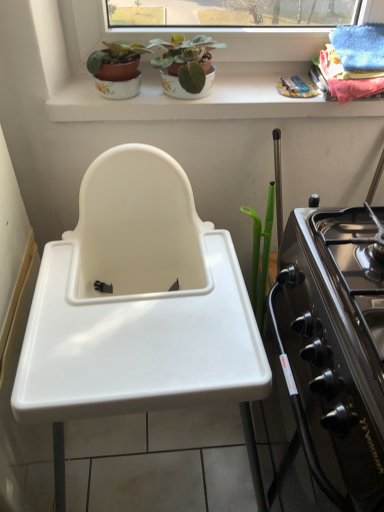
Locate an element on the screen. The width and height of the screenshot is (384, 512). black glossy oven at right is located at coordinates (335, 348).

What do you see at coordinates (203, 99) in the screenshot?
I see `white ceramic window sill at upper center` at bounding box center [203, 99].

The width and height of the screenshot is (384, 512). Describe the element at coordinates (186, 59) in the screenshot. I see `matte ceramic pot at upper center, the 2th houseplant viewed from the left` at that location.

Identify the location of matte ceramic pot at upper center, acting as the second houseplant starting from the right. (117, 69).

Which is more to the left, matte ceramic pot at upper center, acting as the 1th houseplant starting from the right, or black glossy oven at right?

Positioned to the left is matte ceramic pot at upper center, acting as the 1th houseplant starting from the right.

Can we say matte ceramic pot at upper center, acting as the 1th houseplant starting from the right, lies outside black glossy oven at right?

Yes, matte ceramic pot at upper center, acting as the 1th houseplant starting from the right, is located beyond the bounds of black glossy oven at right.

From a real-world perspective, who is located lower, matte ceramic pot at upper center, the 2th houseplant viewed from the left, or black glossy oven at right?

black glossy oven at right is physically lower.

Which point is more distant from viewer, (x=201, y=79) or (x=225, y=113)?

The point (x=225, y=113) is farther from the camera.

From a real-world perspective, relative to white ceramic window sill at upper center, is matte ceramic pot at upper center, the 2th houseplant viewed from the left, vertically above or below?

From a real-world perspective, matte ceramic pot at upper center, the 2th houseplant viewed from the left, is physically above white ceramic window sill at upper center.

Which object is closer to the camera, matte ceramic pot at upper center, acting as the 1th houseplant starting from the right, or white ceramic window sill at upper center?

matte ceramic pot at upper center, acting as the 1th houseplant starting from the right, is closer to the camera.

In order to click on window sill below the matte ceramic pot at upper center, the 2th houseplant viewed from the left (from a real-world perspective) in this screenshot , I will do `click(203, 99)`.

From a real-world perspective, which is physically below, matte ceramic pot at upper center, acting as the 1th houseplant starting from the right, or matte ceramic pot at upper center, acting as the second houseplant starting from the right?

matte ceramic pot at upper center, acting as the second houseplant starting from the right, is physically lower.

From the image's perspective, which one is positioned lower, matte ceramic pot at upper center, acting as the 1th houseplant starting from the right, or matte ceramic pot at upper center, marked as the first houseplant in a left-to-right arrangement?

matte ceramic pot at upper center, acting as the 1th houseplant starting from the right, is shown below in the image.

What's the angular difference between matte ceramic pot at upper center, the 2th houseplant viewed from the left, and matte ceramic pot at upper center, acting as the second houseplant starting from the right,'s facing directions?

The facing directions of matte ceramic pot at upper center, the 2th houseplant viewed from the left, and matte ceramic pot at upper center, acting as the second houseplant starting from the right, are 6.51e-05 degrees apart.

How much distance is there between matte ceramic pot at upper center, the 2th houseplant viewed from the left, and matte ceramic pot at upper center, marked as the first houseplant in a left-to-right arrangement?

4.33 inches.

Considering the relative sizes of matte ceramic pot at upper center, acting as the 1th houseplant starting from the right, and white plastic sink at center in the image provided, is matte ceramic pot at upper center, acting as the 1th houseplant starting from the right, taller than white plastic sink at center?

In fact, matte ceramic pot at upper center, acting as the 1th houseplant starting from the right, may be shorter than white plastic sink at center.

Which is more to the right, matte ceramic pot at upper center, the 2th houseplant viewed from the left, or white plastic sink at center?

From the viewer's perspective, matte ceramic pot at upper center, the 2th houseplant viewed from the left, appears more on the right side.

From the image's perspective, which one is positioned lower, matte ceramic pot at upper center, the 2th houseplant viewed from the left, or white plastic sink at center?

white plastic sink at center appears lower in the image.

Identify the location of the 1st houseplant behind the white plastic sink at center. (186, 59).

What's the angular difference between matte ceramic pot at upper center, marked as the first houseplant in a left-to-right arrangement, and white ceramic window sill at upper center's facing directions?

The angle between the facing direction of matte ceramic pot at upper center, marked as the first houseplant in a left-to-right arrangement, and the facing direction of white ceramic window sill at upper center is 0.694 degrees.

Could you tell me if matte ceramic pot at upper center, marked as the first houseplant in a left-to-right arrangement, is facing white ceramic window sill at upper center?

No, matte ceramic pot at upper center, marked as the first houseplant in a left-to-right arrangement, is not oriented towards white ceramic window sill at upper center.

Does matte ceramic pot at upper center, acting as the second houseplant starting from the right, have a lesser height compared to white ceramic window sill at upper center?

No, matte ceramic pot at upper center, acting as the second houseplant starting from the right, is not shorter than white ceramic window sill at upper center.

From the image's perspective, is matte ceramic pot at upper center, marked as the first houseplant in a left-to-right arrangement, over white ceramic window sill at upper center?

Indeed, from the image's perspective, matte ceramic pot at upper center, marked as the first houseplant in a left-to-right arrangement, is shown above white ceramic window sill at upper center.

Which object is positioned more to the left, black glossy oven at right or matte ceramic pot at upper center, acting as the 1th houseplant starting from the right?

matte ceramic pot at upper center, acting as the 1th houseplant starting from the right, is more to the left.

Based on the photo, is black glossy oven at right far from matte ceramic pot at upper center, acting as the 1th houseplant starting from the right?

That's not correct — black glossy oven at right is a little close to matte ceramic pot at upper center, acting as the 1th houseplant starting from the right.

Which point is more distant from viewer, (365, 352) or (197, 56)?

The point (197, 56) is behind.

Which object is closer to the camera taking this photo, black glossy oven at right or matte ceramic pot at upper center, acting as the 1th houseplant starting from the right?

black glossy oven at right is more forward.

From a real-world perspective, is white ceramic window sill at upper center on black glossy oven at right?

Indeed, from a real-world perspective, white ceramic window sill at upper center stands above black glossy oven at right.

Is white ceramic window sill at upper center thinner than black glossy oven at right?

Indeed, white ceramic window sill at upper center has a lesser width compared to black glossy oven at right.

Looking at the image, does white ceramic window sill at upper center seem bigger or smaller compared to black glossy oven at right?

In the image, white ceramic window sill at upper center appears to be smaller than black glossy oven at right.

Is white ceramic window sill at upper center inside or outside of black glossy oven at right?

white ceramic window sill at upper center lies outside black glossy oven at right.

The height and width of the screenshot is (512, 384). In order to click on the 1st houseplant above the black glossy oven at right (from the image's perspective) in this screenshot , I will do `click(186, 59)`.

At what (x,y) coordinates should I click in order to perform the action: click on houseplant that is the 2nd object above the white ceramic window sill at upper center (from a real-world perspective). Please return your answer as a coordinate pair (x, y). The height and width of the screenshot is (512, 384). Looking at the image, I should click on (186, 59).

Based on their spatial positions, is white plastic sink at center or white ceramic window sill at upper center closer to matte ceramic pot at upper center, the 2th houseplant viewed from the left?

white ceramic window sill at upper center.

Looking at the image, which one is located closer to white ceramic window sill at upper center, matte ceramic pot at upper center, the 2th houseplant viewed from the left, or white plastic sink at center?

matte ceramic pot at upper center, the 2th houseplant viewed from the left.

When comparing their distances from black glossy oven at right, does white plastic sink at center or matte ceramic pot at upper center, marked as the first houseplant in a left-to-right arrangement, seem closer?

Based on the image, white plastic sink at center appears to be nearer to black glossy oven at right.

From the image, which object appears to be nearer to white ceramic window sill at upper center, black glossy oven at right or matte ceramic pot at upper center, acting as the second houseplant starting from the right?

matte ceramic pot at upper center, acting as the second houseplant starting from the right.

Based on their spatial positions, is matte ceramic pot at upper center, acting as the second houseplant starting from the right, or black glossy oven at right closer to matte ceramic pot at upper center, acting as the 1th houseplant starting from the right?

Among the two, matte ceramic pot at upper center, acting as the second houseplant starting from the right, is located nearer to matte ceramic pot at upper center, acting as the 1th houseplant starting from the right.

Considering their positions, is matte ceramic pot at upper center, the 2th houseplant viewed from the left, positioned further to black glossy oven at right than white plastic sink at center?

The object further to black glossy oven at right is matte ceramic pot at upper center, the 2th houseplant viewed from the left.

From the image, which object appears to be nearer to white plastic sink at center, black glossy oven at right or matte ceramic pot at upper center, the 2th houseplant viewed from the left?

The object closer to white plastic sink at center is black glossy oven at right.

Considering their positions, is matte ceramic pot at upper center, marked as the first houseplant in a left-to-right arrangement, positioned closer to matte ceramic pot at upper center, the 2th houseplant viewed from the left, than white ceramic window sill at upper center?

The object closer to matte ceramic pot at upper center, the 2th houseplant viewed from the left, is matte ceramic pot at upper center, marked as the first houseplant in a left-to-right arrangement.

You are a GUI agent. You are given a task and a screenshot of the screen. Output one action in this format:
    pyautogui.click(x=<x>, y=<y>)
    Task: Click on the houseplant situated between matte ceramic pot at upper center, acting as the second houseplant starting from the right, and white ceramic window sill at upper center from left to right
    This screenshot has height=512, width=384.
    Given the screenshot: What is the action you would take?
    pyautogui.click(x=186, y=59)

You are a GUI agent. You are given a task and a screenshot of the screen. Output one action in this format:
    pyautogui.click(x=<x>, y=<y>)
    Task: Click on the oven between matte ceramic pot at upper center, the 2th houseplant viewed from the left, and white plastic sink at center from top to bottom
    The width and height of the screenshot is (384, 512).
    Given the screenshot: What is the action you would take?
    pyautogui.click(x=335, y=348)

Locate an element on the screen. The height and width of the screenshot is (512, 384). oven between white ceramic window sill at upper center and white plastic sink at center vertically is located at coordinates (335, 348).

This screenshot has height=512, width=384. I want to click on window sill between matte ceramic pot at upper center, marked as the first houseplant in a left-to-right arrangement, and white plastic sink at center from top to bottom, so click(x=203, y=99).